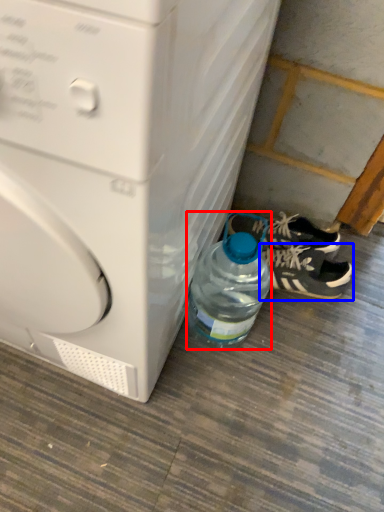
Question: Which of the following is the farthest to the observer, bottle (highlighted by a red box) or footwear (highlighted by a blue box)?

Choices:
 (A) bottle
 (B) footwear

Answer: (B)